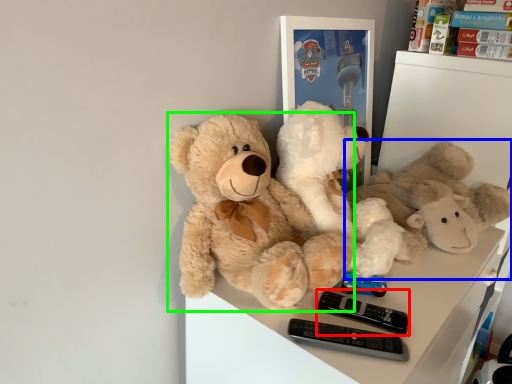
Question: Estimate the real-world distances between objects in this image. Which object is closer to control (highlighted by a red box), teddy bear (highlighted by a blue box) or teddy bear (highlighted by a green box)?

Choices:
 (A) teddy bear
 (B) teddy bear

Answer: (B)